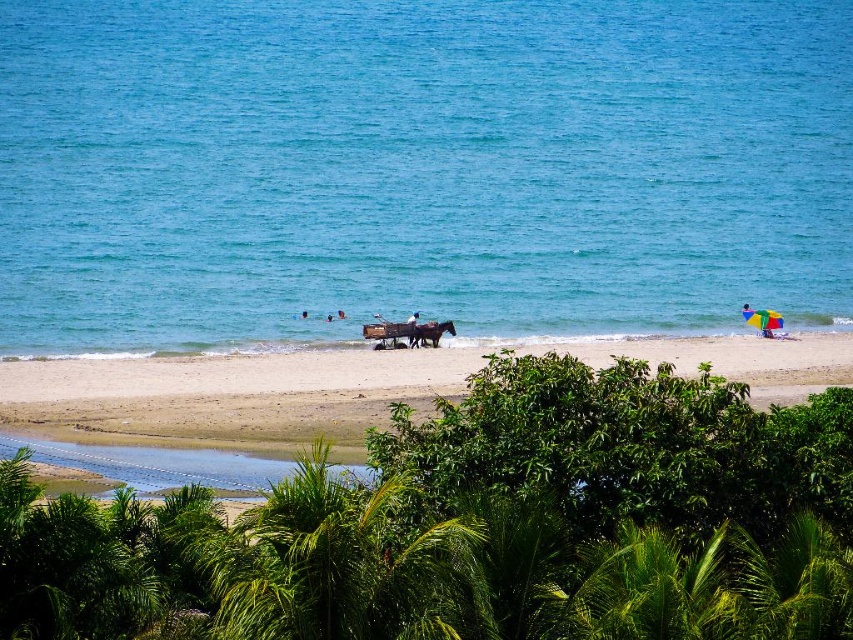
You are standing at the center of the beach and want to take a photo of the brown glossy horse at center. Which direction should you face to ensure the horse is in the center of your photo?

You should face directly towards the brown glossy horse at center, which is located at point coordinates (430,332). Since the horse is already at the center of the beach, pointing your camera towards it will naturally place it in the center of your photo.

You are a photographer standing at the shoreline. You want to take a picture of the brown glossy horse at center and the dark blue fabric at center. Which object will appear closer to the camera in the photo?

The brown glossy horse at center is positioned over dark blue fabric at center, so it will appear closer to the camera in the photo.

You are a beachgoer who wants to set up a new umbrella between the multicolored fabric umbrella at right and the blue fabric umbrella at center. The new umbrella requires at least 3 meters of space between it and both existing umbrellas. Is there enough space between the two existing umbrellas to accommodate this?

The distance between the multicolored fabric umbrella at right and the blue fabric umbrella at center is 2.91 meters, which is less than the required 3 meters. Therefore, there isn not enough space to place the new umbrella between them while maintaining the required distance from both.